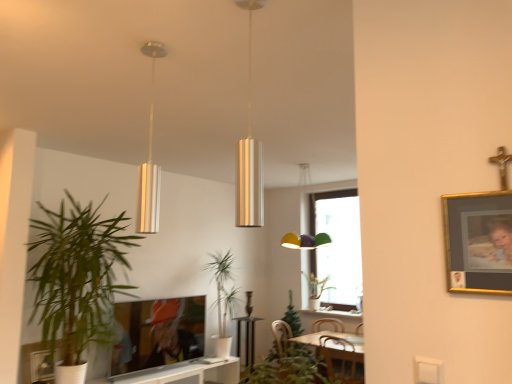
Describe the element at coordinates (77, 275) in the screenshot. I see `green leafy plant at left, positioned as the 4th houseplant in right-to-left order` at that location.

The image size is (512, 384). Identify the location of gold-framed photo at upper right, the 1th picture frame in the right-to-left sequence. (479, 240).

This screenshot has width=512, height=384. What are the coordinates of `green leafy plant at lower center, the 1th houseplant in the front-to-back sequence` in the screenshot? It's located at (287, 369).

Locate an element on the screen. Image resolution: width=512 pixels, height=384 pixels. green leafy plant at center, which is the third houseplant in right-to-left order is located at coordinates (223, 298).

Locate an element on the screen. wooden swivel chair at lower center is located at coordinates (292, 358).

The height and width of the screenshot is (384, 512). Find the location of `metallic silver picture frame at lower left, the 2th picture frame when ordered from top to bottom`. metallic silver picture frame at lower left, the 2th picture frame when ordered from top to bottom is located at coordinates (41, 366).

From the image's perspective, is wooden swivel chair at lower center over metallic silver picture frame at lower left, the 2th picture frame when ordered from top to bottom?

No, from the image's perspective, wooden swivel chair at lower center is not on top of metallic silver picture frame at lower left, the 2th picture frame when ordered from top to bottom.

Would you consider wooden swivel chair at lower center to be distant from metallic silver picture frame at lower left, acting as the 2th picture frame starting from the back?

Indeed, wooden swivel chair at lower center is not near metallic silver picture frame at lower left, acting as the 2th picture frame starting from the back.

Does wooden swivel chair at lower center have a larger size compared to metallic silver picture frame at lower left, positioned as the third picture frame in right-to-left order?

Yes, wooden swivel chair at lower center is bigger than metallic silver picture frame at lower left, positioned as the third picture frame in right-to-left order.

Which is farther from the camera, [279,372] or [36,353]?

Point [36,353]

From a real-world perspective, is metallic silver pendant light at upper center, marked as the 1th lamp in a left-to-right arrangement, positioned under green leafy plant at lower center, which is the 2th houseplant from right to left, based on gravity?

Actually, metallic silver pendant light at upper center, marked as the 1th lamp in a left-to-right arrangement, is physically above green leafy plant at lower center, which is the 2th houseplant from right to left, in the real world.

Which of these two, metallic silver pendant light at upper center, arranged as the 2th lamp when viewed from the right, or green leafy plant at lower center, the fourth houseplant in the back-to-front sequence, stands taller?

With more height is metallic silver pendant light at upper center, arranged as the 2th lamp when viewed from the right.

Locate an element on the screen. The width and height of the screenshot is (512, 384). the 2nd houseplant counting from the right of the metallic silver pendant light at upper center, the 2th lamp from the front is located at coordinates (287, 369).

Is metallic silver pendant light at upper center, arranged as the 1th lamp when viewed from the back, placed right next to green leafy plant at lower center, which is the 2th houseplant from right to left?

There is a gap between metallic silver pendant light at upper center, arranged as the 1th lamp when viewed from the back, and green leafy plant at lower center, which is the 2th houseplant from right to left.

From the image's perspective, would you say wooden swivel chair at lower center is positioned over metallic cylinder at center, the first lamp positioned from the front?

No, from the image's perspective, wooden swivel chair at lower center is not over metallic cylinder at center, the first lamp positioned from the front.

Locate an element on the screen. The width and height of the screenshot is (512, 384). the 1st lamp to the left when counting from the wooden swivel chair at lower center is located at coordinates (249, 151).

Considering the sizes of wooden swivel chair at lower center and metallic cylinder at center, the first lamp positioned from the right, in the image, is wooden swivel chair at lower center bigger or smaller than metallic cylinder at center, the first lamp positioned from the right,?

wooden swivel chair at lower center is bigger than metallic cylinder at center, the first lamp positioned from the right.

Does wooden swivel chair at lower center turn towards metallic cylinder at center, the first lamp positioned from the front?

No, wooden swivel chair at lower center is not aimed at metallic cylinder at center, the first lamp positioned from the front.

Is green leafy plant at center, the second houseplant in the left-to-right sequence, far from green matte plant at center, positioned as the first houseplant in back-to-front order?

Yes, green leafy plant at center, the second houseplant in the left-to-right sequence, is far from green matte plant at center, positioned as the first houseplant in back-to-front order.

The image size is (512, 384). In order to click on the 1st houseplant in front when counting from the green matte plant at center, which ranks as the 4th houseplant in left-to-right order in this screenshot , I will do `click(223, 298)`.

From the image's perspective, which one is positioned lower, green leafy plant at center, placed as the 3th houseplant when sorted from front to back, or green matte plant at center, the 1th houseplant viewed from the right?

From the image's view, green leafy plant at center, placed as the 3th houseplant when sorted from front to back, is below.

Which point is more forward, [211,266] or [323,285]?

The point [323,285] is more forward.

Is metallic silver pendant light at upper center, the 2th lamp from the front, in contact with metallic cylinder at center, the first lamp positioned from the right?

metallic silver pendant light at upper center, the 2th lamp from the front, and metallic cylinder at center, the first lamp positioned from the right, are not in contact.

Is point (152, 108) closer to viewer compared to point (239, 186)?

No, it is behind (239, 186).

Is metallic silver pendant light at upper center, arranged as the 2th lamp when viewed from the right, facing away from metallic cylinder at center, the first lamp positioned from the right?

No, metallic silver pendant light at upper center, arranged as the 2th lamp when viewed from the right, is not facing away from metallic cylinder at center, the first lamp positioned from the right.

Does metallic silver pendant light at upper center, marked as the 1th lamp in a left-to-right arrangement, contain metallic cylinder at center, the first lamp positioned from the right?

No, metallic silver pendant light at upper center, marked as the 1th lamp in a left-to-right arrangement, does not contain metallic cylinder at center, the first lamp positioned from the right.

Which point is more forward, (301, 362) or (75, 365)?

The point (301, 362) is closer to the camera.

Who is more distant, green leafy plant at lower center, the fourth houseplant in the back-to-front sequence, or green leafy plant at left, the third houseplant from the back?

green leafy plant at left, the third houseplant from the back, is further from the camera.

This screenshot has height=384, width=512. Identify the location of houseplant above the green leafy plant at left, the third houseplant from the back (from the image's perspective). (287, 369).

Looking at their sizes, would you say green leafy plant at lower center, which is the 2th houseplant from right to left, is wider or thinner than green leafy plant at left, the 2th houseplant when ordered from front to back?

Clearly, green leafy plant at lower center, which is the 2th houseplant from right to left, has less width compared to green leafy plant at left, the 2th houseplant when ordered from front to back.

Is gold-framed photo at upper right, which appears as the first picture frame when viewed from the front, inside or outside of wooden swivel chair at lower center?

gold-framed photo at upper right, which appears as the first picture frame when viewed from the front, is not inside wooden swivel chair at lower center, it's outside.

Are gold-framed photo at upper right, which appears as the third picture frame when viewed from the back, and wooden swivel chair at lower center far apart?

gold-framed photo at upper right, which appears as the third picture frame when viewed from the back, is positioned a significant distance from wooden swivel chair at lower center.

Which is in front, point (474, 220) or point (289, 331)?

The point (474, 220) is in front.

Is wooden swivel chair at lower center at the back of gold-framed photo at upper right, the 1th picture frame in the top-to-bottom sequence?

That's not correct — gold-framed photo at upper right, the 1th picture frame in the top-to-bottom sequence, is not looking away from wooden swivel chair at lower center.

There is a wooden swivel chair at lower center. Where is `the 2nd picture frame above it (from the image's perspective)`? The width and height of the screenshot is (512, 384). the 2nd picture frame above it (from the image's perspective) is located at coordinates (41, 366).

The image size is (512, 384). I want to click on the 2nd lamp to the left of the green leafy plant at lower center, the fourth houseplant in the back-to-front sequence, starting your count from the anchor, so click(x=149, y=161).

Based on their spatial positions, is wooden swivel chair at lower center or metallic silver pendant light at upper center, the 2th lamp from the front, further from matte black tv at lower center, placed as the 2th picture frame when sorted from left to right?

The object further to matte black tv at lower center, placed as the 2th picture frame when sorted from left to right, is metallic silver pendant light at upper center, the 2th lamp from the front.

Looking at the image, which one is located closer to gold-framed photo at upper right, placed as the 3th picture frame when sorted from bottom to top, green matte plant at center, arranged as the fourth houseplant when viewed from the front, or metallic silver pendant light at upper center, the 2th lamp from the front?

Based on the image, metallic silver pendant light at upper center, the 2th lamp from the front, appears to be nearer to gold-framed photo at upper right, placed as the 3th picture frame when sorted from bottom to top.

Which object lies further to the anchor point metallic cylinder at center, the first lamp positioned from the right, green matte plant at center, arranged as the fourth houseplant when viewed from the front, or green leafy plant at left, the 1th houseplant viewed from the left?

green matte plant at center, arranged as the fourth houseplant when viewed from the front, is positioned further to the anchor metallic cylinder at center, the first lamp positioned from the right.

From the image, which object appears to be farther from metallic silver pendant light at upper center, the 2th lamp from the front, metallic cylinder at center, the first lamp positioned from the front, or green leafy plant at left, the third houseplant from the back?

green leafy plant at left, the third houseplant from the back, is positioned further to the anchor metallic silver pendant light at upper center, the 2th lamp from the front.

Based on their spatial positions, is metallic silver pendant light at upper center, the 2th lamp from the front, or metallic cylinder at center, the first lamp positioned from the right, closer to metallic silver picture frame at lower left, positioned as the third picture frame in right-to-left order?

A: The object closer to metallic silver picture frame at lower left, positioned as the third picture frame in right-to-left order, is metallic silver pendant light at upper center, the 2th lamp from the front.

Looking at the image, which one is located further to gold-framed photo at upper right, which appears as the first picture frame when viewed from the front, green matte plant at center, arranged as the fourth houseplant when viewed from the front, or wooden swivel chair at lower center?

Based on the image, green matte plant at center, arranged as the fourth houseplant when viewed from the front, appears to be further to gold-framed photo at upper right, which appears as the first picture frame when viewed from the front.

From the image, which object appears to be nearer to green leafy plant at left, the third houseplant from the back, green matte plant at center, which ranks as the 4th houseplant in left-to-right order, or matte black tv at lower center, which ranks as the 3th picture frame in top-to-bottom order?

matte black tv at lower center, which ranks as the 3th picture frame in top-to-bottom order.

Estimate the real-world distances between objects in this image. Which object is further from green leafy plant at lower center, the fourth houseplant in the back-to-front sequence, metallic silver pendant light at upper center, arranged as the 2th lamp when viewed from the right, or wooden swivel chair at lower center?

The object further to green leafy plant at lower center, the fourth houseplant in the back-to-front sequence, is metallic silver pendant light at upper center, arranged as the 2th lamp when viewed from the right.

Locate an element on the screen. swivel chair located between green leafy plant at left, the 1th houseplant viewed from the left, and green matte plant at center, arranged as the fourth houseplant when viewed from the front, in the depth direction is located at coordinates (292, 358).

Image resolution: width=512 pixels, height=384 pixels. What are the coordinates of `swivel chair positioned between green leafy plant at lower center, the 1th houseplant in the front-to-back sequence, and green matte plant at center, positioned as the first houseplant in back-to-front order, from near to far` in the screenshot? It's located at (292, 358).

Locate an element on the screen. The height and width of the screenshot is (384, 512). houseplant between green leafy plant at left, the third houseplant from the back, and green matte plant at center, arranged as the fourth houseplant when viewed from the front, from front to back is located at coordinates (223, 298).

Locate an element on the screen. Image resolution: width=512 pixels, height=384 pixels. lamp between metallic silver pendant light at upper center, marked as the 1th lamp in a left-to-right arrangement, and gold-framed photo at upper right, arranged as the 3th picture frame when viewed from the left, in the horizontal direction is located at coordinates (249, 151).